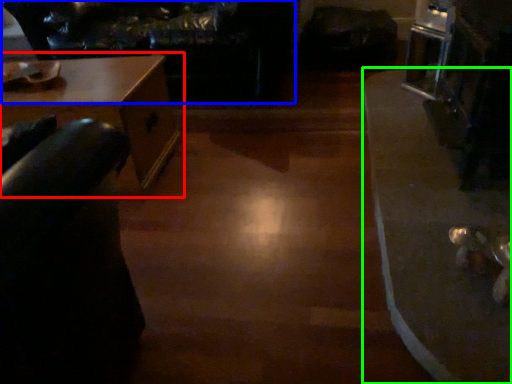
Question: Which object is positioned farthest from table (highlighted by a red box)? Select from couch (highlighted by a blue box) and table (highlighted by a green box).

Choices:
 (A) couch
 (B) table

Answer: (B)